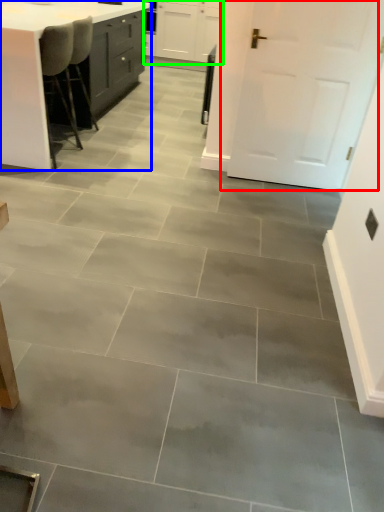
Question: Which is nearer to the door (highlighted by a red box)? table (highlighted by a blue box) or cabinetry (highlighted by a green box).

Choices:
 (A) table
 (B) cabinetry

Answer: (A)